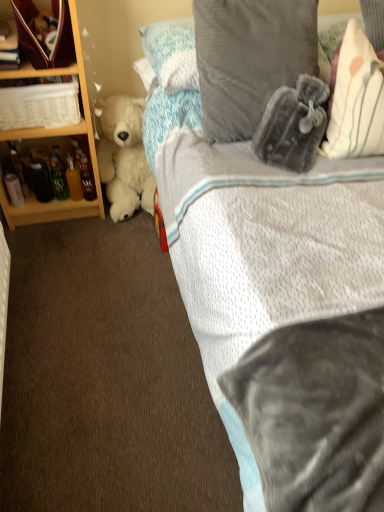
Question: From the image's perspective, is velvet maroon bag at upper left beneath matte glass bottle at left?

Choices:
 (A) yes
 (B) no

Answer: (B)

Question: Would you say velvet maroon bag at upper left is outside matte glass bottle at left?

Choices:
 (A) yes
 (B) no

Answer: (A)

Question: From the image's perspective, is velvet maroon bag at upper left over matte glass bottle at left?

Choices:
 (A) yes
 (B) no

Answer: (A)

Question: From a real-world perspective, is velvet maroon bag at upper left below matte glass bottle at left?

Choices:
 (A) no
 (B) yes

Answer: (A)

Question: Is velvet maroon bag at upper left positioned in front of matte glass bottle at left?

Choices:
 (A) yes
 (B) no

Answer: (A)

Question: From a real-world perspective, is velvet maroon bag at upper left positioned above or below velvety gray pillow at upper right?

Choices:
 (A) below
 (B) above

Answer: (B)

Question: Do you think velvet maroon bag at upper left is within velvety gray pillow at upper right, or outside of it?

Choices:
 (A) outside
 (B) inside

Answer: (A)

Question: Would you say velvet maroon bag at upper left is to the left or to the right of velvety gray pillow at upper right in the picture?

Choices:
 (A) left
 (B) right

Answer: (A)

Question: From the image's perspective, is velvet maroon bag at upper left located above or below velvety gray pillow at upper right?

Choices:
 (A) below
 (B) above

Answer: (B)

Question: From their relative heights in the image, would you say velvety gray pillow at upper right is taller or shorter than white soft pillow at upper right, placed as the first pillow when sorted from right to left?

Choices:
 (A) short
 (B) tall

Answer: (B)

Question: Based on their sizes in the image, would you say velvety gray pillow at upper right is bigger or smaller than white soft pillow at upper right, placed as the first pillow when sorted from right to left?

Choices:
 (A) big
 (B) small

Answer: (A)

Question: From a real-world perspective, is velvety gray pillow at upper right above or below white soft pillow at upper right, placed as the first pillow when sorted from right to left?

Choices:
 (A) above
 (B) below

Answer: (B)

Question: In the image, is velvety gray pillow at upper right on the left side or the right side of white soft pillow at upper right, arranged as the 2th pillow when viewed from the left?

Choices:
 (A) right
 (B) left

Answer: (B)

Question: Considering the positions of point (29, 93) and point (261, 352), is point (29, 93) closer or farther from the camera than point (261, 352)?

Choices:
 (A) farther
 (B) closer

Answer: (A)

Question: From the image's perspective, is white plastic basket at left above or below velvety gray pillow at upper right?

Choices:
 (A) above
 (B) below

Answer: (A)